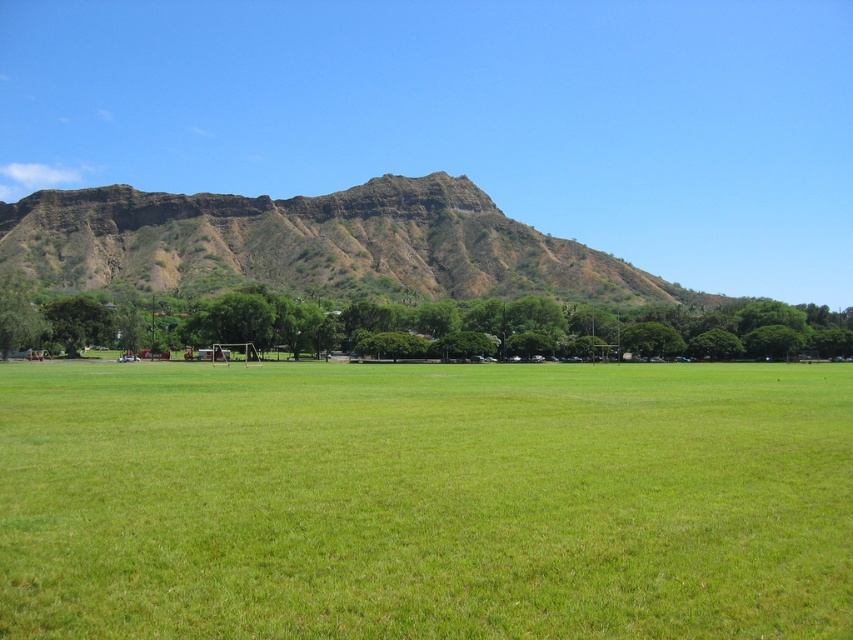
Between point (561, 614) and point (0, 291), which one is positioned behind?

Positioned behind is point (0, 291).

Who is taller, green grass at center or green leafy tree at center?

With more height is green leafy tree at center.

Measure the distance between point (608, 369) and camera.

The distance of point (608, 369) from camera is 328.78 feet.

Where is `green grass at center`? The image size is (853, 640). green grass at center is located at coordinates (425, 500).

Does green grass at center have a lesser width compared to brown rocky mountain at upper center?

Correct, green grass at center's width is less than brown rocky mountain at upper center's.

Is point (605, 364) positioned behind point (422, 221)?

No, (605, 364) is in front of (422, 221).

Describe the element at coordinates (425, 500) in the screenshot. I see `green grass at center` at that location.

What are the coordinates of `green grass at center` in the screenshot? It's located at (425, 500).

Which is behind, point (521, 240) or point (207, 328)?

The point (521, 240) is behind.

Is brown rocky mountain at upper center further to camera compared to green leafy tree at center?

That is True.

I want to click on brown rocky mountain at upper center, so click(316, 244).

At what (x,y) coordinates should I click in order to perform the action: click on brown rocky mountain at upper center. Please return your answer as a coordinate pair (x, y). The image size is (853, 640). Looking at the image, I should click on (316, 244).